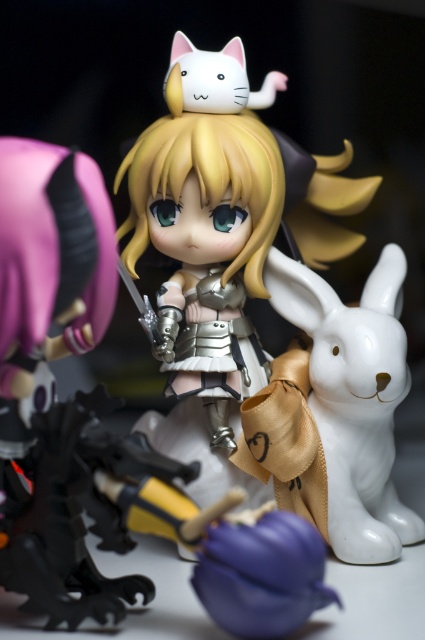
Does satin gold armor at center have a greater width compared to white glossy rabbit at right?

Yes, satin gold armor at center is wider than white glossy rabbit at right.

From the picture: Can you confirm if satin gold armor at center is smaller than white glossy rabbit at right?

Incorrect, satin gold armor at center is not smaller in size than white glossy rabbit at right.

At what (x,y) coordinates should I click in order to perform the action: click on satin gold armor at center. Please return your answer as a coordinate pair (x, y). This screenshot has height=640, width=425. Looking at the image, I should click on (223, 220).

At what (x,y) coordinates should I click in order to perform the action: click on satin gold armor at center. Please return your answer as a coordinate pair (x, y). The height and width of the screenshot is (640, 425). Looking at the image, I should click on (223, 220).